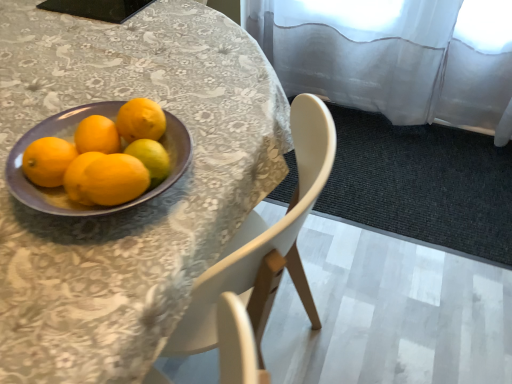
Question: Is the depth of yellow matte lemon at center greater than that of purple glossy bowl at left?

Choices:
 (A) yes
 (B) no

Answer: (A)

Question: Is yellow matte lemon at center shorter than purple glossy bowl at left?

Choices:
 (A) yes
 (B) no

Answer: (A)

Question: From the image's perspective, is yellow matte lemon at center below purple glossy bowl at left?

Choices:
 (A) no
 (B) yes

Answer: (A)

Question: Does yellow matte lemon at center have a larger size compared to purple glossy bowl at left?

Choices:
 (A) yes
 (B) no

Answer: (B)

Question: Is yellow matte lemon at center aimed at purple glossy bowl at left?

Choices:
 (A) no
 (B) yes

Answer: (A)

Question: Considering the positions of purple plate at upper left and matte yellow orange at left in the image, is purple plate at upper left taller or shorter than matte yellow orange at left?

Choices:
 (A) tall
 (B) short

Answer: (A)

Question: Choose the correct answer: Is purple plate at upper left inside matte yellow orange at left or outside it?

Choices:
 (A) inside
 (B) outside

Answer: (B)

Question: Considering the positions of purple plate at upper left and matte yellow orange at left in the image, is purple plate at upper left wider or thinner than matte yellow orange at left?

Choices:
 (A) wide
 (B) thin

Answer: (A)

Question: From a real-world perspective, is purple plate at upper left physically located above or below matte yellow orange at left?

Choices:
 (A) above
 (B) below

Answer: (B)

Question: From a real-world perspective, is purple glossy bowl at left above or below purple plate at upper left?

Choices:
 (A) above
 (B) below

Answer: (A)

Question: Based on their sizes in the image, would you say purple glossy bowl at left is bigger or smaller than purple plate at upper left?

Choices:
 (A) big
 (B) small

Answer: (B)

Question: Based on their positions, is purple glossy bowl at left located to the left or right of purple plate at upper left?

Choices:
 (A) right
 (B) left

Answer: (B)

Question: Relative to purple plate at upper left, is purple glossy bowl at left in front or behind?

Choices:
 (A) behind
 (B) front

Answer: (A)

Question: Is purple glossy bowl at left wider or thinner than yellow matte lemon at center?

Choices:
 (A) thin
 (B) wide

Answer: (B)

Question: From the image's perspective, relative to yellow matte lemon at center, is purple glossy bowl at left above or below?

Choices:
 (A) above
 (B) below

Answer: (B)